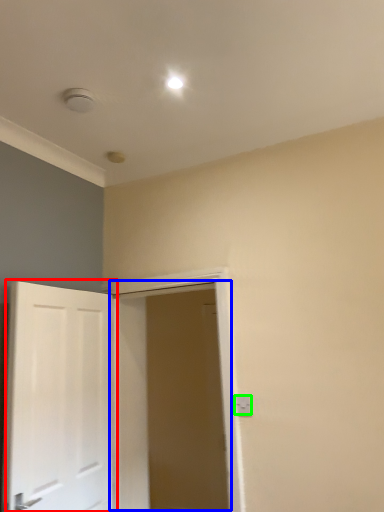
Question: Based on their relative distances, which object is farther from door (highlighted by a red box)? Choose from door (highlighted by a blue box) and electric outlet (highlighted by a green box).

Choices:
 (A) door
 (B) electric outlet

Answer: (B)